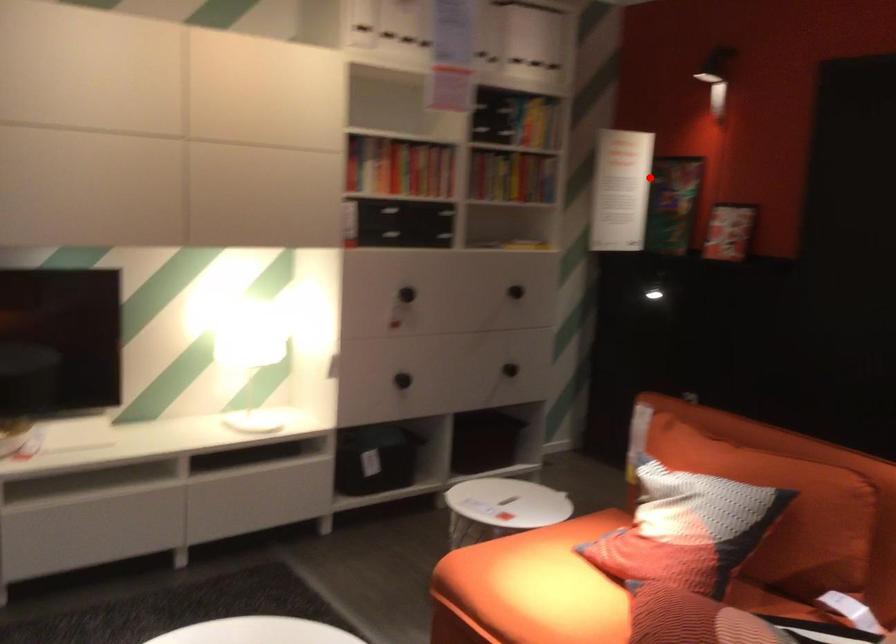
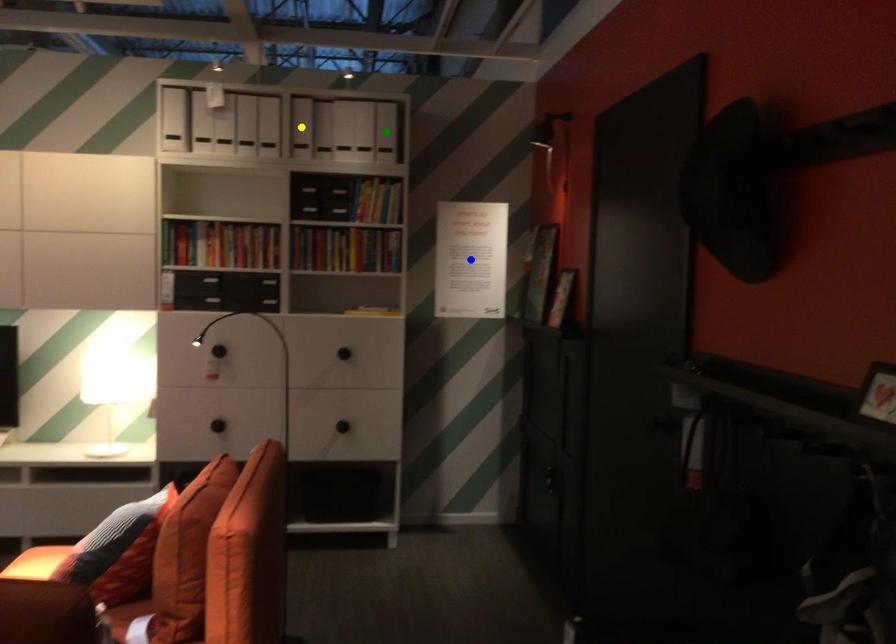
Question: I am providing you with two images of the same scene from different viewpoints. A red point is marked on the first image. You are given multiple points on the second image. Which point in image 2 represents the same 3d spot as the red point in image 1?

Choices:
 (A) green point
 (B) blue point
 (C) yellow point

Answer: (B)